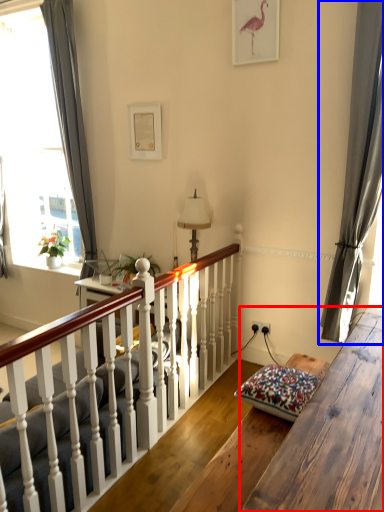
Question: Which object is closer to the camera taking this photo, table (highlighted by a red box) or curtain (highlighted by a blue box)?

Choices:
 (A) table
 (B) curtain

Answer: (A)